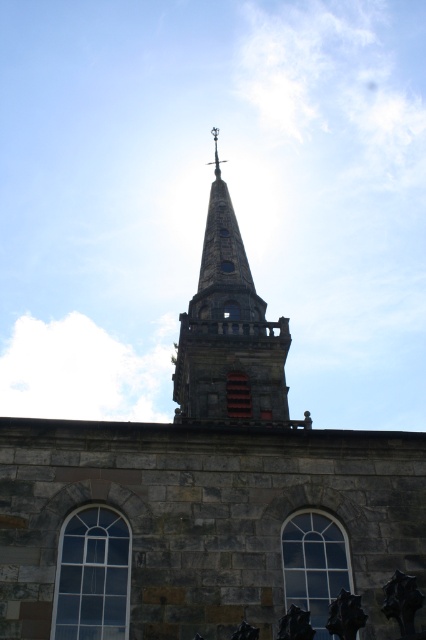
Describe the element at coordinates (229, 332) in the screenshot. Image resolution: width=426 pixels, height=640 pixels. I see `stone steeple at upper center` at that location.

The width and height of the screenshot is (426, 640). I want to click on stone steeple at upper center, so click(x=229, y=332).

This screenshot has width=426, height=640. What are the coordinates of `stone steeple at upper center` in the screenshot? It's located at (229, 332).

Is point (216, 300) farther from viewer compared to point (111, 563)?

Yes, point (216, 300) is behind point (111, 563).

Who is more distant from viewer, (287, 419) or (121, 525)?

A: Positioned behind is point (287, 419).

You are a GUI agent. You are given a task and a screenshot of the screen. Output one action in this format:
    pyautogui.click(x=<x>, y=<y>)
    Task: Click on the stone steeple at upper center
    The width and height of the screenshot is (426, 640).
    Given the screenshot: What is the action you would take?
    pyautogui.click(x=229, y=332)

Who is lower down, clear glass window at lower left or clear glass window at center?

clear glass window at center

Is clear glass window at lower left positioned before clear glass window at center?

That is True.

Between point (106, 540) and point (319, 518), which one is positioned behind?

The point (319, 518) is more distant.

This screenshot has height=640, width=426. In order to click on clear glass window at lower left in this screenshot , I will do `click(92, 576)`.